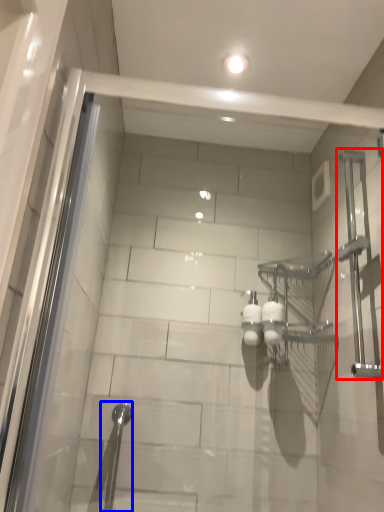
Question: Which object is closer to the camera taking this photo, shower (highlighted by a red box) or shower (highlighted by a blue box)?

Choices:
 (A) shower
 (B) shower

Answer: (A)